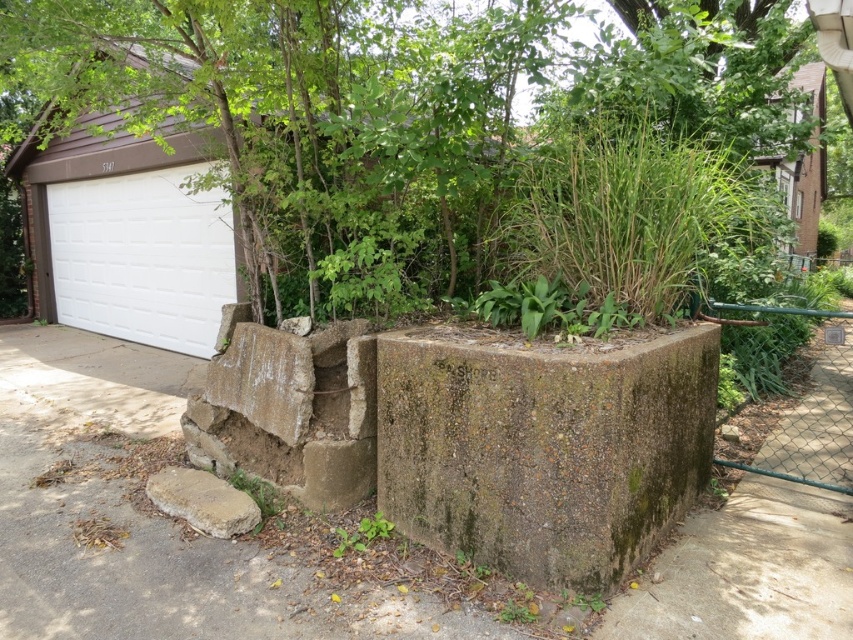
Question: In this image, where is white painted concrete garage door at upper left located relative to green chain-link fence at right?

Choices:
 (A) right
 (B) left

Answer: (B)

Question: Which object is closer to the camera taking this photo?

Choices:
 (A) brown rough stone at lower left
 (B) white smooth garage door at left

Answer: (A)

Question: From the image, what is the correct spatial relationship of green leafy tree at center in relation to green mossy concrete block at center?

Choices:
 (A) left
 (B) right

Answer: (A)

Question: Observing the image, what is the correct spatial positioning of brown rough stone at lower left in reference to green leafy plant at lower center?

Choices:
 (A) left
 (B) right

Answer: (A)

Question: Which point appears farthest from the camera in this image?

Choices:
 (A) (138, 250)
 (B) (361, 518)
 (C) (161, 333)
 (D) (483, 465)

Answer: (A)

Question: Estimate the real-world distances between objects in this image. Which object is farther from the green chain-link fence at right?

Choices:
 (A) brown rough stone at lower left
 (B) green leafy plant at lower center

Answer: (A)